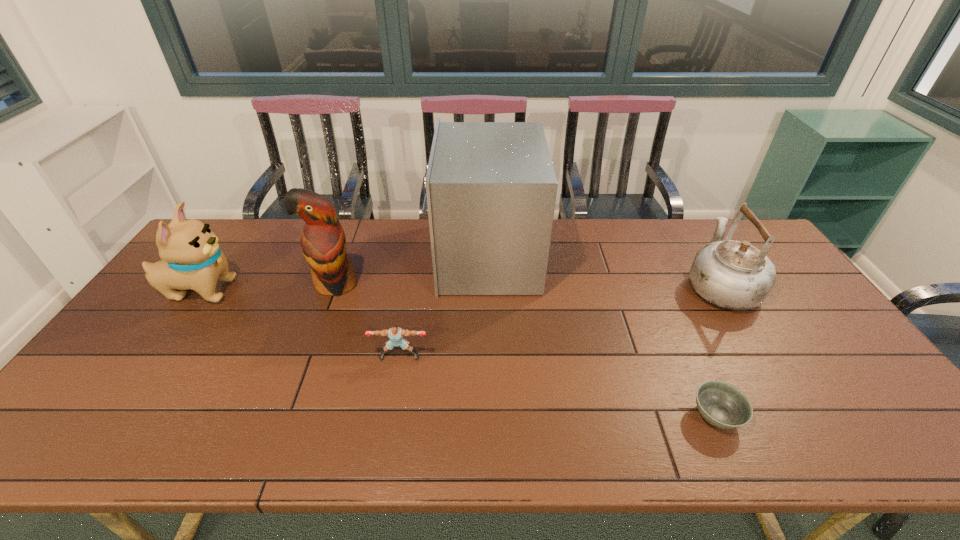
This screenshot has width=960, height=540. Find the location of `toaster oven`. toaster oven is located at coordinates (490, 187).

This screenshot has width=960, height=540. I want to click on parrot, so click(x=323, y=243).

You are a GUI agent. You are given a task and a screenshot of the screen. Output one action in this format:
    pyautogui.click(x=<x>, y=<y>)
    Task: Click on the leftmost object
    The width and height of the screenshot is (960, 540).
    Given the screenshot: What is the action you would take?
    (191, 257)

This screenshot has height=540, width=960. Find the location of `kettle`. kettle is located at coordinates coord(733,275).

Find the location of a particular element. This screenshot has height=540, width=960. the fifth tallest object is located at coordinates (395, 333).

I want to click on the fifth farthest object, so click(395, 333).

This screenshot has height=540, width=960. Identify the location of the shortest object. (723, 405).

I want to click on bowl, so click(x=723, y=405).

Find the location of a particular element. Image resolution: width=960 pixels, height=540 pixels. free space located on the front panel of the toaster oven is located at coordinates (397, 257).

Identify the location of vacant region located on the front panel of the toaster oven. The width and height of the screenshot is (960, 540). (364, 257).